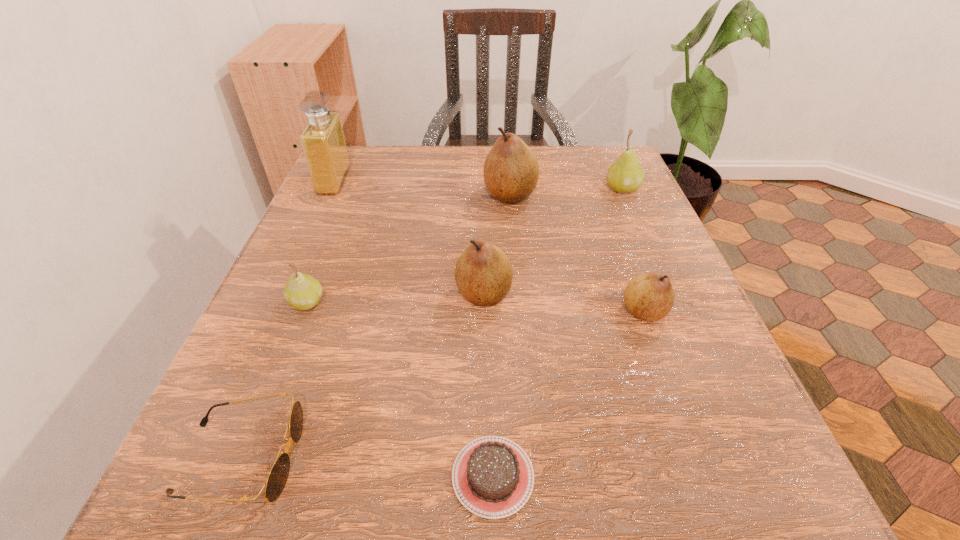
At what (x,y) coordinates should I click in order to perform the action: click on free point between the bigger green pear and the second shortest object. Please return your answer as a coordinate pair (x, y). The width and height of the screenshot is (960, 540). Looking at the image, I should click on (432, 323).

Find the location of `vacant area that lies between the second biggest brown pear and the second shortest object`. vacant area that lies between the second biggest brown pear and the second shortest object is located at coordinates (363, 375).

In order to click on unoccupied position between the tallest object and the left green pear in this screenshot , I will do `click(321, 241)`.

The image size is (960, 540). I want to click on free space between the leftmost pear and the bigger green pear, so click(465, 246).

The image size is (960, 540). In order to click on vacant space that is in between the rightmost brown pear and the chocolate cake in this screenshot , I will do `click(568, 394)`.

Locate an element on the screen. This screenshot has width=960, height=540. vacant space in between the farther green pear and the tallest pear is located at coordinates (566, 192).

Find the location of a particular element. This screenshot has width=960, height=540. free space between the leftmost pear and the bigger green pear is located at coordinates (465, 246).

Locate an element on the screen. The width and height of the screenshot is (960, 540). free spot between the shortest object and the second biggest brown pear is located at coordinates (489, 384).

Where is `the seventh closest object to the second shortest object`? Image resolution: width=960 pixels, height=540 pixels. the seventh closest object to the second shortest object is located at coordinates (626, 175).

You are a GUI agent. You are given a task and a screenshot of the screen. Output one action in this format:
    pyautogui.click(x=<x>, y=<y>)
    Task: Click on the object that stands as the sixth closest to the chocolate cake
    
    Given the screenshot: What is the action you would take?
    pyautogui.click(x=626, y=175)